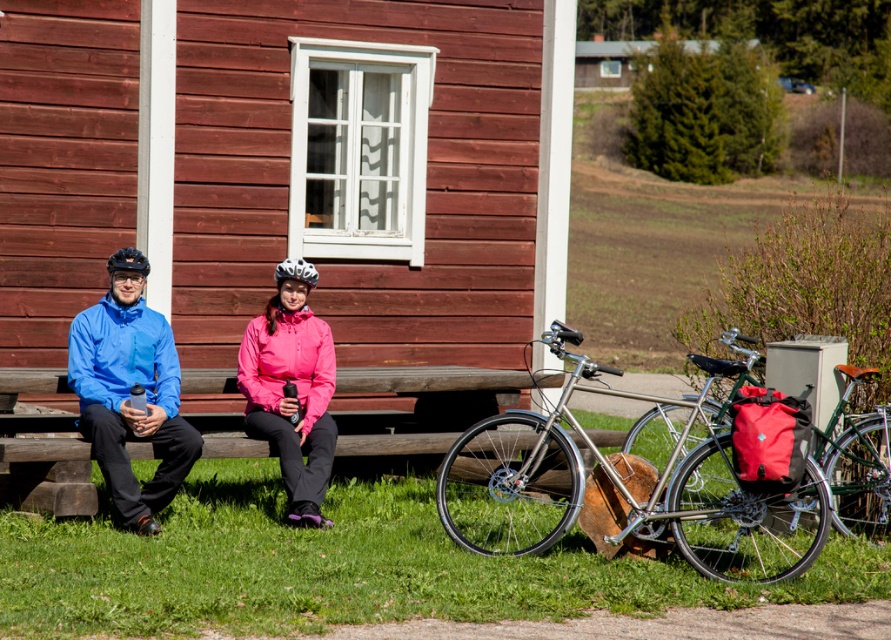
Does blue waterproof jacket at left have a greater width compared to wooden bench at center?

No.

Which is behind, point (101, 376) or point (442, 445)?

The point (442, 445) is behind.

I want to click on blue waterproof jacket at left, so click(127, 394).

Can you confirm if silver metallic bicycle at lower right is positioned to the left of wooden bench at center?

No, silver metallic bicycle at lower right is not to the left of wooden bench at center.

The image size is (891, 640). Identify the location of silver metallic bicycle at lower right. (517, 472).

What do you see at coordinates (517, 472) in the screenshot? I see `silver metallic bicycle at lower right` at bounding box center [517, 472].

I want to click on silver metallic bicycle at lower right, so click(517, 472).

Is blue waterproof jacket at left wider than pink matte jacket at center?

Yes.

Is the position of blue waterproof jacket at left less distant than that of pink matte jacket at center?

Yes.

Is point (158, 419) behind point (295, 454)?

No, it is not.

Image resolution: width=891 pixels, height=640 pixels. Identify the location of blue waterproof jacket at left. (127, 394).